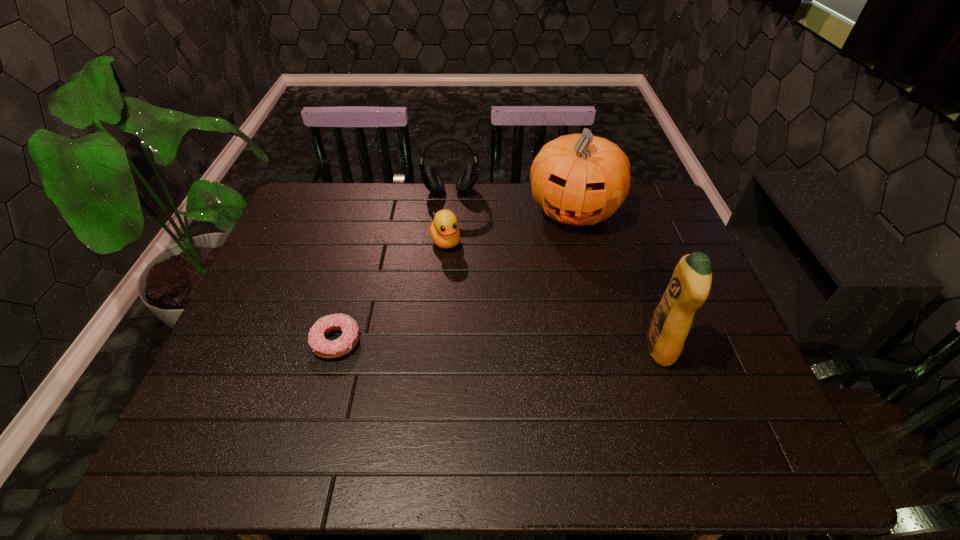
Where is `free space on the desktop that is between the doughnut and the detergent and is positioned on the face of the second shortest object`? free space on the desktop that is between the doughnut and the detergent and is positioned on the face of the second shortest object is located at coordinates (495, 344).

Where is `free space on the desktop that is between the shortest object and the detergent and is positioned on the ear cups of the headset`? free space on the desktop that is between the shortest object and the detergent and is positioned on the ear cups of the headset is located at coordinates (452, 343).

Find the location of a particular element. free space on the desktop that is between the doughnut and the detergent and is positioned on the front-facing side of the pumpkin is located at coordinates (542, 345).